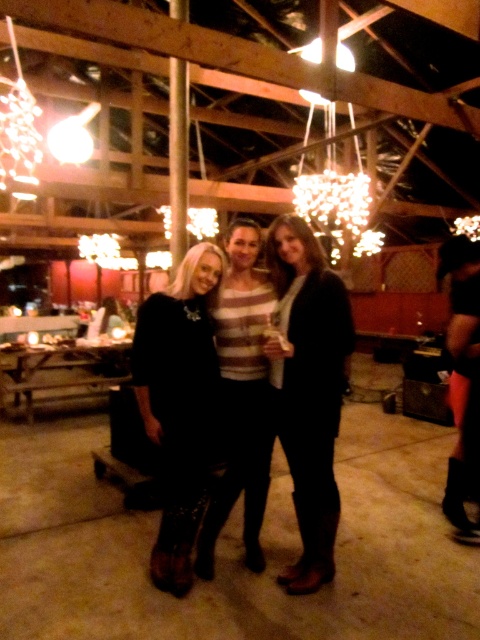
Question: Which point is farther to the camera?

Choices:
 (A) black leather dress at center
 (B) striped sweater at center

Answer: (B)

Question: Can you confirm if black leather dress at center is smaller than striped sweater at center?

Choices:
 (A) yes
 (B) no

Answer: (B)

Question: Which of the following is the closest to the observer?

Choices:
 (A) (332, 486)
 (B) (168, 476)
 (C) (252, 387)

Answer: (A)

Question: Can you confirm if black leather dress at center is positioned above striped sweater at center?

Choices:
 (A) yes
 (B) no

Answer: (B)

Question: Is black leather dress at center to the left of striped sweater at center from the viewer's perspective?

Choices:
 (A) no
 (B) yes

Answer: (B)

Question: Which point is closer to the camera?

Choices:
 (A) striped sweater at center
 (B) black leather pants at center
 (C) black leather dress at center

Answer: (B)